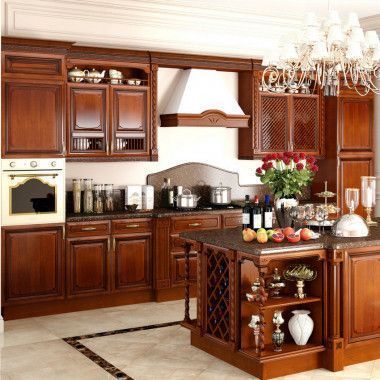
I want to click on oven, so click(x=38, y=199).